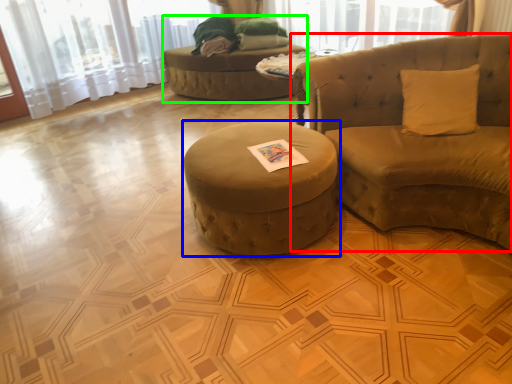
Question: Considering the real-world distances, which object is farthest from studio couch (highlighted by a red box)? table (highlighted by a blue box) or bean bag chair (highlighted by a green box)?

Choices:
 (A) table
 (B) bean bag chair

Answer: (B)